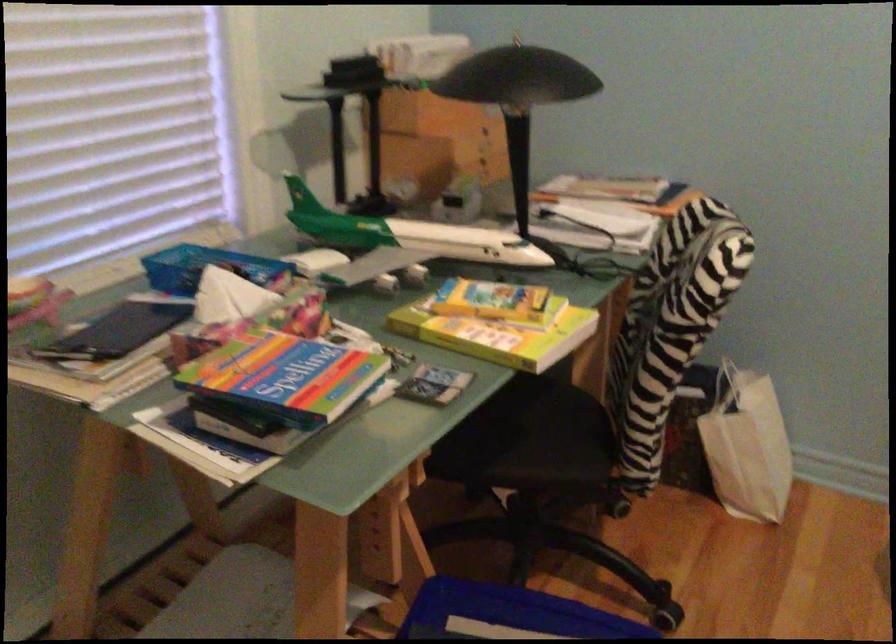
Find the location of a particular element. Image resolution: width=896 pixels, height=644 pixels. colorful spelling book is located at coordinates (285, 377).